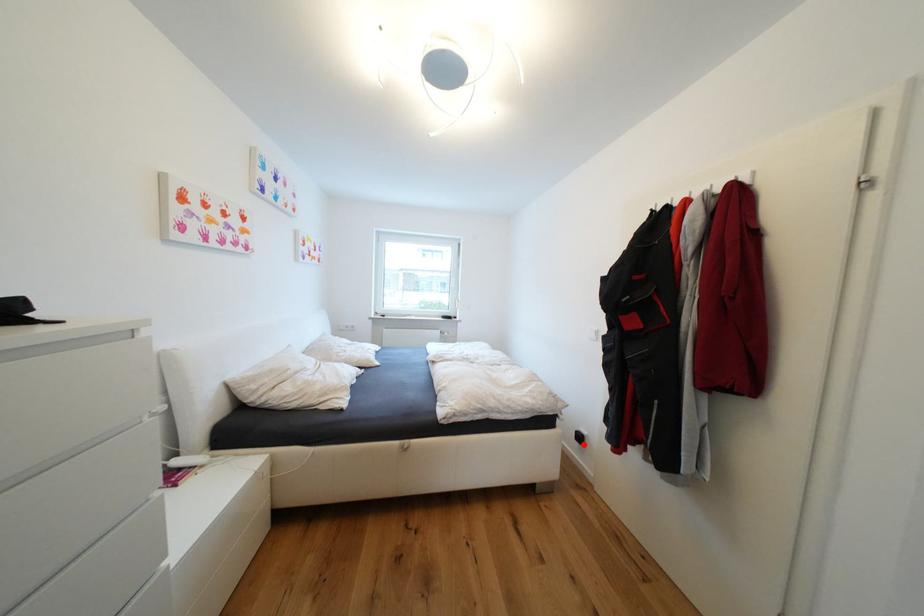
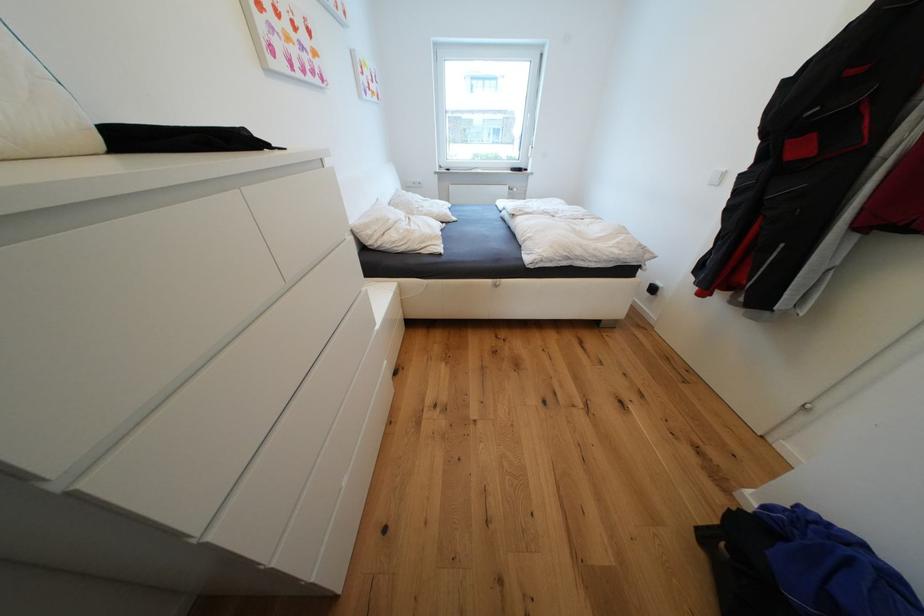
Question: I am providing you with two images of the same scene from different viewpoints. In image1, a red point is highlighted. Considering the same 3D point in image2, which of the following is correct?

Choices:
 (A) It is closer
 (B) It is farther

Answer: (A)